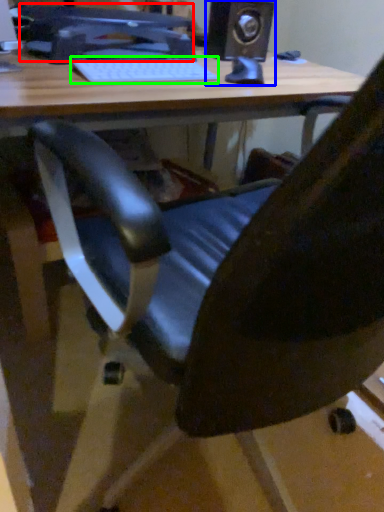
Question: Which object is positioned closest to computer monitor (highlighted by a red box)? Select from speaker (highlighted by a blue box) and laptop keyboard (highlighted by a green box).

Choices:
 (A) speaker
 (B) laptop keyboard

Answer: (B)